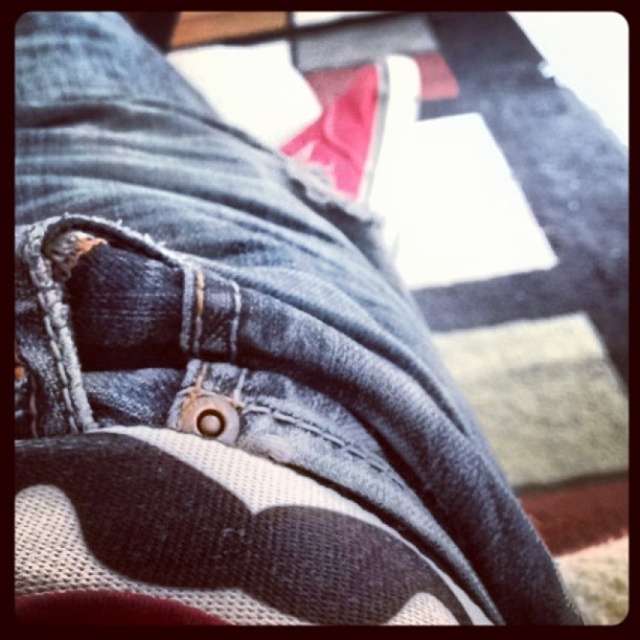
You are a photographer setting up a shoot and need to position two shoes for a product photo. You have a black canvas shoe at lower center and a matte pink fabric shoe at center. The client wants the shoes to be exactly 36 inches apart. Based on their current positions, do you need to move them closer or farther apart?

The black canvas shoe at lower center is currently 33.38 inches away from the matte pink fabric shoe at center. Since 33.38 is less than 36, you need to move them farther apart to reach the desired distance.